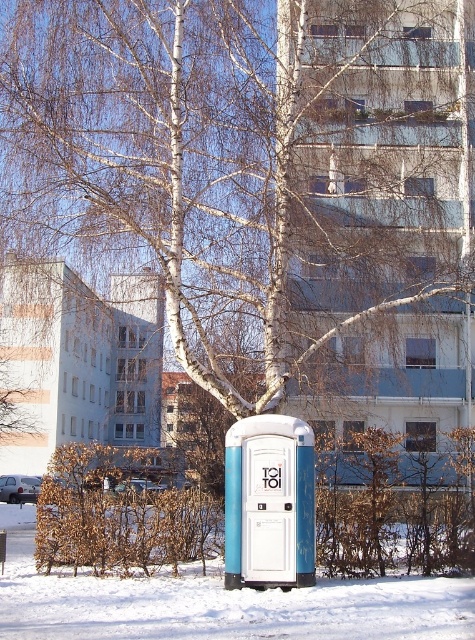
Between brown leafy shrub at lower left and blue plastic toilet at center, which one appears on the left side from the viewer's perspective?

From the viewer's perspective, brown leafy shrub at lower left appears more on the left side.

Is brown leafy shrub at lower left to the left of blue plastic toilet at center from the viewer's perspective?

Yes, brown leafy shrub at lower left is to the left of blue plastic toilet at center.

Is point (216, 509) positioned behind point (272, 528)?

Yes.

Locate an element on the screen. brown leafy shrub at lower left is located at coordinates (119, 513).

Does white powdery snow at lower center have a lesser width compared to blue plastic toilet at center?

Incorrect, white powdery snow at lower center's width is not less than blue plastic toilet at center's.

Who is higher up, white powdery snow at lower center or blue plastic toilet at center?

blue plastic toilet at center is higher up.

Is point (206, 636) positioned after point (284, 564)?

No, (206, 636) is in front of (284, 564).

Where is `white powdery snow at lower center`? This screenshot has height=640, width=475. white powdery snow at lower center is located at coordinates (218, 604).

Which is behind, point (190, 577) or point (195, 550)?

The point (195, 550) is more distant.

Which is in front, point (436, 618) or point (67, 524)?

Point (436, 618)

Image resolution: width=475 pixels, height=640 pixels. What are the coordinates of `white powdery snow at lower center` in the screenshot? It's located at (218, 604).